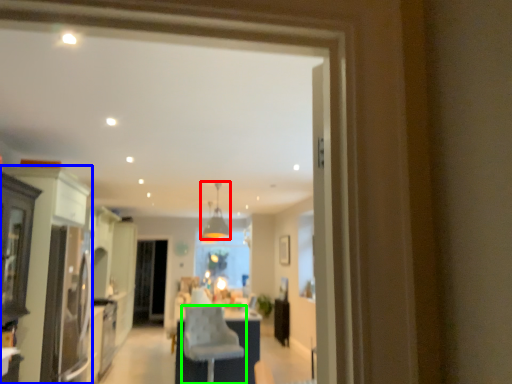
Question: Considering the real-world distances, which object is closest to light fixture (highlighted by a red box)? cabinetry (highlighted by a blue box) or chair (highlighted by a green box).

Choices:
 (A) cabinetry
 (B) chair

Answer: (B)